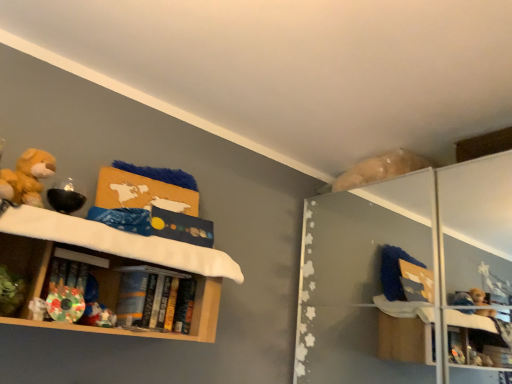
Locate an element on the screen. Image resolution: width=512 pixels, height=384 pixels. fluffy yellow teddy bear at left is located at coordinates (27, 177).

Describe the element at coordinates (27, 177) in the screenshot. The image size is (512, 384). I see `fluffy yellow teddy bear at left` at that location.

The height and width of the screenshot is (384, 512). I want to click on hardcover books at shelf center, so click(148, 297).

From a real-world perspective, is wooden shelf at left physically below hardcover books at shelf center?

Incorrect, from a real-world perspective, wooden shelf at left is higher than hardcover books at shelf center.

What are the coordinates of `book below the wooden shelf at left (from a real-world perspective)` in the screenshot? It's located at (148, 297).

Is wooden shelf at left next to hardcover books at shelf center?

There is a gap between wooden shelf at left and hardcover books at shelf center.

Considering the relative sizes of wooden shelf at left and hardcover books at shelf center in the image provided, is wooden shelf at left wider than hardcover books at shelf center?

Yes.

Considering the relative positions of fluffy yellow teddy bear at left and hardcover books at shelf center in the image provided, is fluffy yellow teddy bear at left to the right of hardcover books at shelf center from the viewer's perspective?

Incorrect, fluffy yellow teddy bear at left is not on the right side of hardcover books at shelf center.

From a real-world perspective, which is physically above, fluffy yellow teddy bear at left or hardcover books at shelf center?

In real-world perspective, fluffy yellow teddy bear at left is above.

Which object is further away from the camera taking this photo, fluffy yellow teddy bear at left or hardcover books at shelf center?

hardcover books at shelf center is behind.

Looking at the image, does fluffy yellow teddy bear at left seem bigger or smaller compared to hardcover books at shelf center?

Considering their sizes, fluffy yellow teddy bear at left takes up less space than hardcover books at shelf center.

Consider the image. Which object is more forward, wooden shelf at left or fluffy yellow teddy bear at left?

wooden shelf at left is in front.

Consider the image. Considering the sizes of wooden shelf at left and fluffy yellow teddy bear at left in the image, is wooden shelf at left bigger or smaller than fluffy yellow teddy bear at left?

Considering their sizes, wooden shelf at left takes up more space than fluffy yellow teddy bear at left.

Locate an element on the screen. shelf lying below the fluffy yellow teddy bear at left (from the image's perspective) is located at coordinates (127, 257).

Which of these two, wooden shelf at left or fluffy yellow teddy bear at left, is thinner?

fluffy yellow teddy bear at left is thinner.

Considering the relative positions of hardcover books at shelf center and wooden shelf at left in the image provided, is hardcover books at shelf center behind wooden shelf at left?

Yes, it is.

In terms of height, does hardcover books at shelf center look taller or shorter compared to wooden shelf at left?

Considering their sizes, hardcover books at shelf center has less height than wooden shelf at left.

Which object is wider, hardcover books at shelf center or wooden shelf at left?

wooden shelf at left.

Can you tell me how much hardcover books at shelf center and wooden shelf at left differ in facing direction?

The angle between the facing direction of hardcover books at shelf center and the facing direction of wooden shelf at left is 1.7 degrees.

From a real-world perspective, is fluffy yellow teddy bear at left below wooden shelf at left?

No.

Considering the relative sizes of fluffy yellow teddy bear at left and wooden shelf at left in the image provided, is fluffy yellow teddy bear at left wider than wooden shelf at left?

No, fluffy yellow teddy bear at left is not wider than wooden shelf at left.

Is fluffy yellow teddy bear at left oriented away from wooden shelf at left?

fluffy yellow teddy bear at left is not turned away from wooden shelf at left.

Would you say wooden shelf at left is part of fluffy yellow teddy bear at left's contents?

No, wooden shelf at left is not surrounded by fluffy yellow teddy bear at left.

Would you say fluffy yellow teddy bear at left is part of hardcover books at shelf center's contents?

No.

Could you tell me if hardcover books at shelf center is turned towards fluffy yellow teddy bear at left?

No, hardcover books at shelf center does not turn towards fluffy yellow teddy bear at left.

Which is closer to the camera, (126, 280) or (27, 196)?

Point (126, 280) is positioned farther from the camera compared to point (27, 196).

At what (x,y) coordinates should I click in order to perform the action: click on shelf above the hardcover books at shelf center (from the image's perspective). Please return your answer as a coordinate pair (x, y). The height and width of the screenshot is (384, 512). Looking at the image, I should click on (127, 257).

Locate an element on the screen. Image resolution: width=512 pixels, height=384 pixels. book below the fluffy yellow teddy bear at left (from a real-world perspective) is located at coordinates 148,297.

Based on their spatial positions, is fluffy yellow teddy bear at left or hardcover books at shelf center closer to wooden shelf at left?

The object closer to wooden shelf at left is hardcover books at shelf center.

Considering their positions, is wooden shelf at left positioned closer to hardcover books at shelf center than fluffy yellow teddy bear at left?

Among the two, wooden shelf at left is located nearer to hardcover books at shelf center.

Based on their spatial positions, is fluffy yellow teddy bear at left or wooden shelf at left further from hardcover books at shelf center?

fluffy yellow teddy bear at left lies further to hardcover books at shelf center than the other object.

When comparing their distances from wooden shelf at left, does hardcover books at shelf center or fluffy yellow teddy bear at left seem closer?

hardcover books at shelf center.

Looking at the image, which one is located closer to fluffy yellow teddy bear at left, wooden shelf at left or hardcover books at shelf center?

wooden shelf at left.

Considering their positions, is hardcover books at shelf center positioned closer to fluffy yellow teddy bear at left than wooden shelf at left?

wooden shelf at left lies closer to fluffy yellow teddy bear at left than the other object.

Identify the location of toy between wooden shelf at left and hardcover books at shelf center in the front-back direction. This screenshot has height=384, width=512. (27, 177).